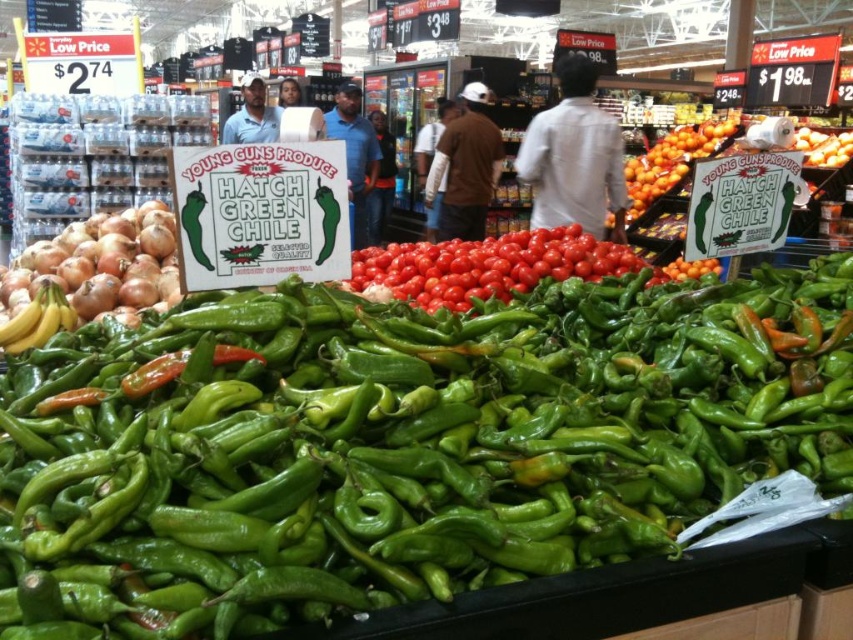
You are a grocery store employee who needs to place a new sign between the brown matte onion at left and the dark blue jeans at center. The sign is 1.5 meters long. Will there be enough space between them to fit the sign?

The distance between the brown matte onion at left and the dark blue jeans at center is 5.54 meters, which is more than enough to fit a 1.5 meter long sign between them.

You are a grocery store employee organizing items. You need to place a brown matte onion at left and dark blue jeans at center on a shelf. If the shelf has a height limit of 1 meter, will both items fit vertically without exceeding the limit?

The brown matte onion at left is shorter than the dark blue jeans at center, but the exact heights are not provided. However, since onions and jeans are typically under 1 meter in height when stacked or placed normally, both items are likely to fit within the 1 meter height limit.